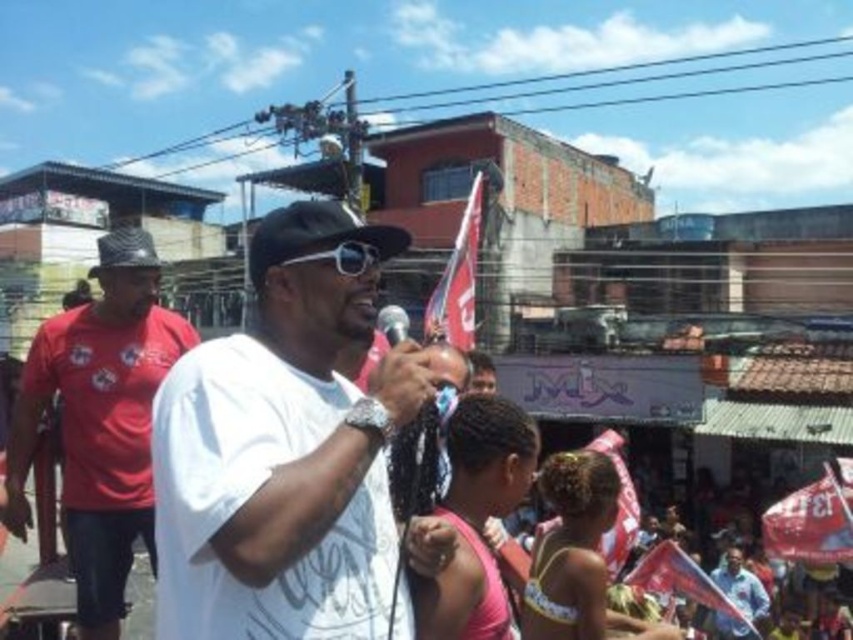
Can you confirm if matte red shirt at left is positioned to the right of black matte baseball cap at center?

In fact, matte red shirt at left is to the left of black matte baseball cap at center.

Is matte red shirt at left shorter than black matte baseball cap at center?

In fact, matte red shirt at left may be taller than black matte baseball cap at center.

In order to click on matte red shirt at left in this screenshot , I will do `click(100, 420)`.

Is white matte t-shirt at center to the left of metallic silver microphone at center from the viewer's perspective?

Correct, you'll find white matte t-shirt at center to the left of metallic silver microphone at center.

Can you confirm if white matte t-shirt at center is taller than metallic silver microphone at center?

Indeed, white matte t-shirt at center has a greater height compared to metallic silver microphone at center.

From the picture: Measure the distance between white matte t-shirt at center and camera.

white matte t-shirt at center and camera are 17.99 meters apart.

You are a GUI agent. You are given a task and a screenshot of the screen. Output one action in this format:
    pyautogui.click(x=<x>, y=<y>)
    Task: Click on the white matte t-shirt at center
    This screenshot has width=853, height=640.
    Given the screenshot: What is the action you would take?
    pyautogui.click(x=283, y=448)

Is black matte baseball cap at center above blue fabric flag at lower right?

Correct, black matte baseball cap at center is located above blue fabric flag at lower right.

Who is positioned more to the right, black matte baseball cap at center or blue fabric flag at lower right?

From the viewer's perspective, blue fabric flag at lower right appears more on the right side.

Where is `black matte baseball cap at center`? This screenshot has width=853, height=640. black matte baseball cap at center is located at coordinates (316, 232).